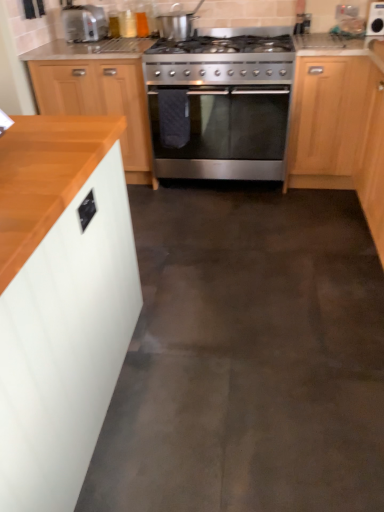
How much space does satin silver pot at upper center, which ranks as the first appliance in left-to-right order, occupy horizontally?

The width of satin silver pot at upper center, which ranks as the first appliance in left-to-right order, is 8.78 inches.

Identify the location of white matte cabinet at left, arranged as the 3th cabinetry when viewed from the back. (60, 301).

The height and width of the screenshot is (512, 384). Describe the element at coordinates (60, 301) in the screenshot. I see `white matte cabinet at left, the 3th cabinetry from the right` at that location.

What do you see at coordinates (326, 118) in the screenshot?
I see `light wood cabinet at right, placed as the 1th cabinetry when sorted from right to left` at bounding box center [326, 118].

Image resolution: width=384 pixels, height=512 pixels. What are the coordinates of `stainless steel oven at center` in the screenshot? It's located at (219, 131).

What do you see at coordinates (98, 91) in the screenshot? Image resolution: width=384 pixels, height=512 pixels. I see `wooden cabinet at left, which is the second cabinetry in right-to-left order` at bounding box center [98, 91].

Describe the element at coordinates (84, 23) in the screenshot. The image size is (384, 512). I see `matte silver toaster at upper left` at that location.

Where is `stainless steel gas stove at center`? The image size is (384, 512). stainless steel gas stove at center is located at coordinates pyautogui.click(x=220, y=61).

Does light wood cabinet at right, positioned as the third cabinetry in left-to-right order, turn towards stainless steel gas stove at center?

No, light wood cabinet at right, positioned as the third cabinetry in left-to-right order, does not turn towards stainless steel gas stove at center.

Is light wood cabinet at right, positioned as the third cabinetry in left-to-right order, bigger than stainless steel gas stove at center?

Correct, light wood cabinet at right, positioned as the third cabinetry in left-to-right order, is larger in size than stainless steel gas stove at center.

Find the location of a particular element. This screenshot has width=384, height=512. gas stove above the light wood cabinet at right, placed as the 1th cabinetry when sorted from right to left (from the image's perspective) is located at coordinates (220, 61).

Looking at this image, is stainless steel oven at center shorter than wooden cabinet at left, the 2th cabinetry when ordered from left to right?

Correct, stainless steel oven at center is not as tall as wooden cabinet at left, the 2th cabinetry when ordered from left to right.

Is stainless steel oven at center facing away from wooden cabinet at left, which is the second cabinetry in right-to-left order?

No.

How many degrees apart are the facing directions of stainless steel oven at center and wooden cabinet at left, acting as the first cabinetry starting from the back?

0.91 degrees separate the facing orientations of stainless steel oven at center and wooden cabinet at left, acting as the first cabinetry starting from the back.

Considering the positions of objects white glossy microwave at upper right, which ranks as the 2th appliance in left-to-right order, and satin silver pot at upper center, marked as the second appliance in a right-to-left arrangement, in the image provided, who is more to the left, white glossy microwave at upper right, which ranks as the 2th appliance in left-to-right order, or satin silver pot at upper center, marked as the second appliance in a right-to-left arrangement,?

satin silver pot at upper center, marked as the second appliance in a right-to-left arrangement.

From the image's perspective, which is below, white glossy microwave at upper right, which is counted as the 1th appliance, starting from the right, or satin silver pot at upper center, marked as the second appliance in a right-to-left arrangement?

satin silver pot at upper center, marked as the second appliance in a right-to-left arrangement.

What's the angular difference between white glossy microwave at upper right, which is counted as the 1th appliance, starting from the right, and satin silver pot at upper center, which ranks as the first appliance in left-to-right order,'s facing directions?

There is a 1.09-degree angle between the facing directions of white glossy microwave at upper right, which is counted as the 1th appliance, starting from the right, and satin silver pot at upper center, which ranks as the first appliance in left-to-right order.

How far apart are white glossy microwave at upper right, which is counted as the 1th appliance, starting from the right, and satin silver pot at upper center, marked as the second appliance in a right-to-left arrangement?

A distance of 3.91 feet exists between white glossy microwave at upper right, which is counted as the 1th appliance, starting from the right, and satin silver pot at upper center, marked as the second appliance in a right-to-left arrangement.

Consider the image. Which is correct: white glossy microwave at upper right, which is counted as the 1th appliance, starting from the right, is inside white matte cabinet at left, which is the 1th cabinetry from left to right, or outside of it?

white glossy microwave at upper right, which is counted as the 1th appliance, starting from the right, is not enclosed by white matte cabinet at left, which is the 1th cabinetry from left to right.

In the scene shown: Could you tell me if white glossy microwave at upper right, which is counted as the 1th appliance, starting from the right, is turned towards white matte cabinet at left, the 3th cabinetry from the right?

No, white glossy microwave at upper right, which is counted as the 1th appliance, starting from the right, is not aimed at white matte cabinet at left, the 3th cabinetry from the right.

From a real-world perspective, which is physically above, white glossy microwave at upper right, which ranks as the 2th appliance in left-to-right order, or white matte cabinet at left, the 1th cabinetry when ordered from front to back?

In real-world perspective, white glossy microwave at upper right, which ranks as the 2th appliance in left-to-right order, is above.

Considering the positions of objects white glossy microwave at upper right, which is counted as the 1th appliance, starting from the right, and white matte cabinet at left, which is the 1th cabinetry from left to right, in the image provided, who is behind, white glossy microwave at upper right, which is counted as the 1th appliance, starting from the right, or white matte cabinet at left, which is the 1th cabinetry from left to right,?

white glossy microwave at upper right, which is counted as the 1th appliance, starting from the right, is behind.

Would you say wooden cabinet at left, acting as the first cabinetry starting from the back, is inside or outside light wood cabinet at right, the 2th cabinetry in the front-to-back sequence?

wooden cabinet at left, acting as the first cabinetry starting from the back, is outside light wood cabinet at right, the 2th cabinetry in the front-to-back sequence.

Is point (51, 51) farther from viewer compared to point (311, 149)?

That is True.

This screenshot has height=512, width=384. Find the location of `cabinetry that appears on the right of wooden cabinet at left, the third cabinetry when ordered from front to back`. cabinetry that appears on the right of wooden cabinet at left, the third cabinetry when ordered from front to back is located at coordinates (326, 118).

Is the surface of wooden cabinet at left, the third cabinetry when ordered from front to back, in direct contact with light wood cabinet at right, placed as the 1th cabinetry when sorted from right to left?

wooden cabinet at left, the third cabinetry when ordered from front to back, is not next to light wood cabinet at right, placed as the 1th cabinetry when sorted from right to left, and they're not touching.

In the scene shown: Are wooden cabinet at left, the 2th cabinetry when ordered from left to right, and satin silver pot at upper center, which ranks as the first appliance in left-to-right order, located far from each other?

No.

Which object is positioned more to the right, wooden cabinet at left, acting as the first cabinetry starting from the back, or satin silver pot at upper center, which ranks as the first appliance in left-to-right order?

From the viewer's perspective, satin silver pot at upper center, which ranks as the first appliance in left-to-right order, appears more on the right side.

How many degrees apart are the facing directions of wooden cabinet at left, the 2th cabinetry when ordered from left to right, and satin silver pot at upper center, marked as the second appliance in a right-to-left arrangement?

There is a 0.207-degree angle between the facing directions of wooden cabinet at left, the 2th cabinetry when ordered from left to right, and satin silver pot at upper center, marked as the second appliance in a right-to-left arrangement.

Considering the relative sizes of wooden cabinet at left, acting as the first cabinetry starting from the back, and satin silver pot at upper center, which ranks as the first appliance in left-to-right order, in the image provided, is wooden cabinet at left, acting as the first cabinetry starting from the back, thinner than satin silver pot at upper center, which ranks as the first appliance in left-to-right order,?

No, wooden cabinet at left, acting as the first cabinetry starting from the back, is not thinner than satin silver pot at upper center, which ranks as the first appliance in left-to-right order.

Considering the relative positions of stainless steel oven at center and white matte cabinet at left, the 3th cabinetry from the right, in the image provided, is stainless steel oven at center to the right of white matte cabinet at left, the 3th cabinetry from the right, from the viewer's perspective?

Indeed, stainless steel oven at center is positioned on the right side of white matte cabinet at left, the 3th cabinetry from the right.

From a real-world perspective, is stainless steel oven at center physically below white matte cabinet at left, the 3th cabinetry from the right?

Yes, from a real-world perspective, stainless steel oven at center is under white matte cabinet at left, the 3th cabinetry from the right.

Between point (191, 117) and point (79, 420), which one is positioned behind?

The point (191, 117) is more distant.

Locate an element on the screen. Image resolution: width=384 pixels, height=512 pixels. gas stove that appears above the light wood cabinet at right, placed as the 1th cabinetry when sorted from right to left (from the image's perspective) is located at coordinates (220, 61).

In order to click on cabinetry that appears behind the stainless steel oven at center in this screenshot , I will do `click(98, 91)`.

Looking at the image, which one is located closer to white glossy microwave at upper right, which ranks as the 2th appliance in left-to-right order, wooden cabinet at left, the third cabinetry when ordered from front to back, or satin silver pot at upper center, which ranks as the first appliance in left-to-right order?

satin silver pot at upper center, which ranks as the first appliance in left-to-right order, lies closer to white glossy microwave at upper right, which ranks as the 2th appliance in left-to-right order, than the other object.

Looking at the image, which one is located further to stainless steel oven at center, light wood cabinet at right, the 2th cabinetry in the front-to-back sequence, or satin silver pot at upper center, marked as the second appliance in a right-to-left arrangement?

Among the two, satin silver pot at upper center, marked as the second appliance in a right-to-left arrangement, is located further to stainless steel oven at center.

Based on their spatial positions, is satin silver pot at upper center, marked as the second appliance in a right-to-left arrangement, or stainless steel oven at center further from white glossy microwave at upper right, which ranks as the 2th appliance in left-to-right order?

Based on the image, satin silver pot at upper center, marked as the second appliance in a right-to-left arrangement, appears to be further to white glossy microwave at upper right, which ranks as the 2th appliance in left-to-right order.

Based on their spatial positions, is wooden cabinet at left, which is the second cabinetry in right-to-left order, or satin silver pot at upper center, which ranks as the first appliance in left-to-right order, closer to matte silver toaster at upper left?

satin silver pot at upper center, which ranks as the first appliance in left-to-right order, is closer to matte silver toaster at upper left.

When comparing their distances from light wood cabinet at right, which is the 2th cabinetry in back-to-front order, does wooden cabinet at left, the 2th cabinetry when ordered from left to right, or stainless steel gas stove at center seem further?

wooden cabinet at left, the 2th cabinetry when ordered from left to right, is positioned further to the anchor light wood cabinet at right, which is the 2th cabinetry in back-to-front order.

Estimate the real-world distances between objects in this image. Which object is further from white matte cabinet at left, arranged as the 3th cabinetry when viewed from the back, matte silver toaster at upper left or white glossy microwave at upper right, which is counted as the 1th appliance, starting from the right?

white glossy microwave at upper right, which is counted as the 1th appliance, starting from the right.

Based on their spatial positions, is white glossy microwave at upper right, which is counted as the 1th appliance, starting from the right, or wooden cabinet at left, the third cabinetry when ordered from front to back, further from stainless steel gas stove at center?

white glossy microwave at upper right, which is counted as the 1th appliance, starting from the right.

Consider the image. Based on their spatial positions, is stainless steel gas stove at center or matte silver toaster at upper left further from stainless steel oven at center?

The object further to stainless steel oven at center is matte silver toaster at upper left.

I want to click on gas stove situated between matte silver toaster at upper left and stainless steel oven at center from left to right, so click(220, 61).

Locate an element on the screen. cabinetry between wooden cabinet at left, the 2th cabinetry when ordered from left to right, and white glossy microwave at upper right, which is counted as the 1th appliance, starting from the right, from left to right is located at coordinates (326, 118).

Locate an element on the screen. cabinetry between stainless steel oven at center and white glossy microwave at upper right, which is counted as the 1th appliance, starting from the right is located at coordinates (326, 118).

Where is `appliance between wooden cabinet at left, which is the second cabinetry in right-to-left order, and light wood cabinet at right, placed as the 1th cabinetry when sorted from right to left, from left to right`? The width and height of the screenshot is (384, 512). appliance between wooden cabinet at left, which is the second cabinetry in right-to-left order, and light wood cabinet at right, placed as the 1th cabinetry when sorted from right to left, from left to right is located at coordinates (177, 23).